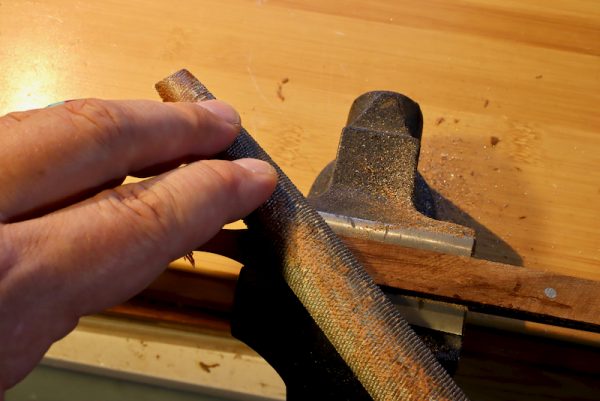
Image resolution: width=600 pixels, height=401 pixels. What are the coordinates of `knob` in the screenshot? It's located at (379, 102).